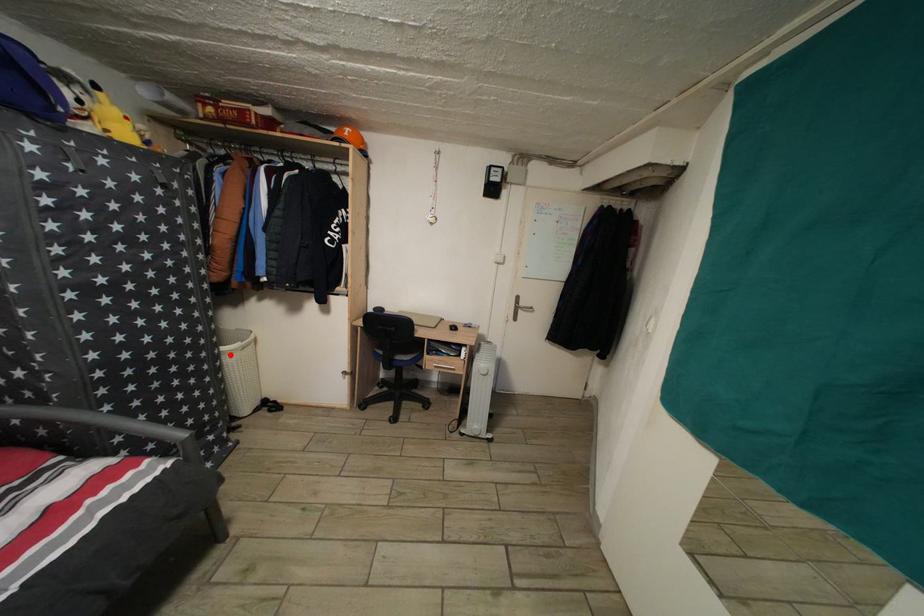
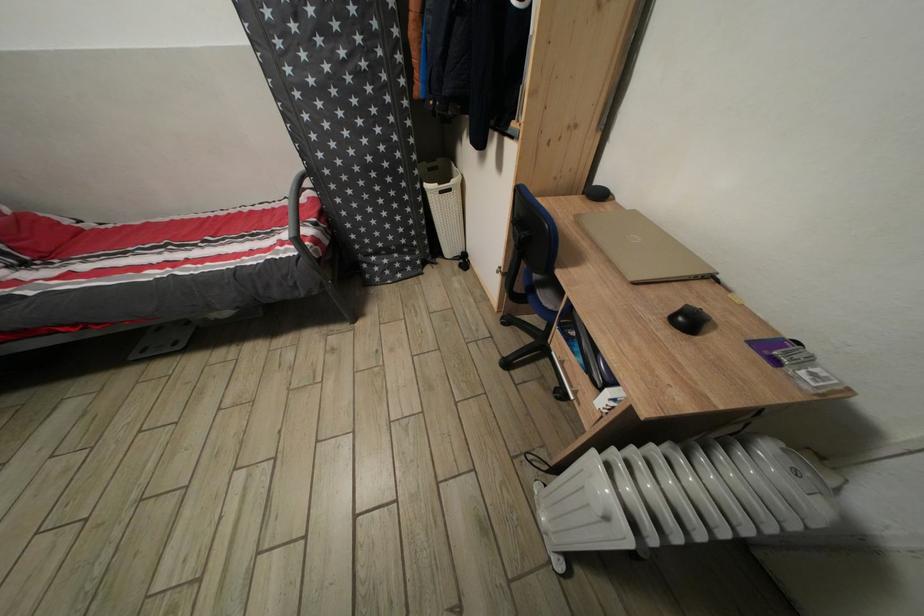
Locate, in the second image, the point that corresponds to the highlighted location in the first image.

(432, 192)